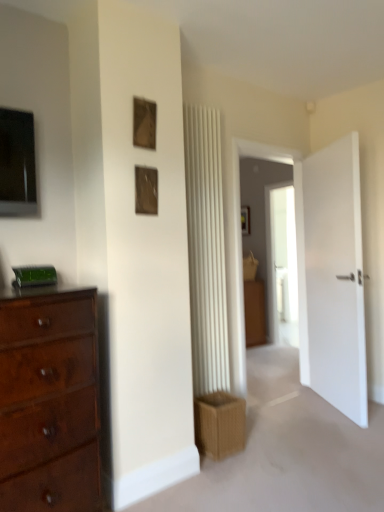
Question: Does wooden picture frame at upper center, which is the first picture frame in bottom-to-top order, have a smaller size compared to wooden frame at upper center, the 1th picture frame when ordered from top to bottom?

Choices:
 (A) yes
 (B) no

Answer: (B)

Question: Is wooden picture frame at upper center, which is the first picture frame in bottom-to-top order, wider than wooden frame at upper center, which is counted as the 2th picture frame, starting from the bottom?

Choices:
 (A) yes
 (B) no

Answer: (A)

Question: From a real-world perspective, does wooden picture frame at upper center, which is the second picture frame from top to bottom, stand above wooden frame at upper center, which is counted as the 2th picture frame, starting from the bottom?

Choices:
 (A) no
 (B) yes

Answer: (A)

Question: Is wooden picture frame at upper center, which is the second picture frame from top to bottom, located outside wooden frame at upper center, the 1th picture frame when ordered from top to bottom?

Choices:
 (A) no
 (B) yes

Answer: (B)

Question: From a real-world perspective, is wooden picture frame at upper center, which is the first picture frame in bottom-to-top order, below wooden frame at upper center, the 1th picture frame when ordered from top to bottom?

Choices:
 (A) no
 (B) yes

Answer: (B)

Question: Is wooden picture frame at upper center, which is the second picture frame from top to bottom, bigger than wooden frame at upper center, which is counted as the 2th picture frame, starting from the bottom?

Choices:
 (A) yes
 (B) no

Answer: (A)

Question: Is mahogany wood dresser at left oriented towards wooden frame at upper center, which is counted as the 2th picture frame, starting from the bottom?

Choices:
 (A) yes
 (B) no

Answer: (B)

Question: Is mahogany wood dresser at left wider than wooden frame at upper center, which is counted as the 2th picture frame, starting from the bottom?

Choices:
 (A) yes
 (B) no

Answer: (A)

Question: Is mahogany wood dresser at left to the right of wooden frame at upper center, which is counted as the 2th picture frame, starting from the bottom, from the viewer's perspective?

Choices:
 (A) yes
 (B) no

Answer: (B)

Question: From the image's perspective, is mahogany wood dresser at left located above wooden frame at upper center, which is counted as the 2th picture frame, starting from the bottom?

Choices:
 (A) no
 (B) yes

Answer: (A)

Question: Is mahogany wood dresser at left placed right next to wooden frame at upper center, which is counted as the 2th picture frame, starting from the bottom?

Choices:
 (A) no
 (B) yes

Answer: (A)

Question: Can you confirm if mahogany wood dresser at left is shorter than wooden frame at upper center, the 1th picture frame when ordered from top to bottom?

Choices:
 (A) yes
 (B) no

Answer: (B)

Question: Can you confirm if brown cardboard crate at lower center is taller than wooden frame at upper center, the 1th picture frame when ordered from top to bottom?

Choices:
 (A) yes
 (B) no

Answer: (A)